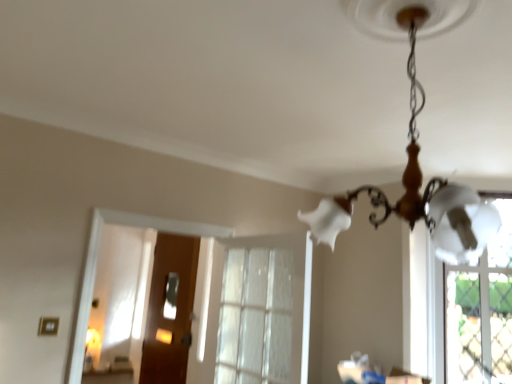
This screenshot has height=384, width=512. I want to click on clear glass window at center, so click(255, 317).

This screenshot has width=512, height=384. What are the coordinates of `wooden door at center` in the screenshot? It's located at (172, 307).

From a real-world perspective, is wooden door at center below white glass chandelier at upper center?

Yes, from a real-world perspective, wooden door at center is under white glass chandelier at upper center.

Is wooden door at center far away from white glass chandelier at upper center?

That's right, there is a large distance between wooden door at center and white glass chandelier at upper center.

Is wooden door at center in front of white glass chandelier at upper center?

No, the depth of wooden door at center is greater than that of white glass chandelier at upper center.

Consider the image. Which is correct: wooden door at center is inside clear glass window at center, or outside of it?

wooden door at center is not inside clear glass window at center, it's outside.

From the image's perspective, is wooden door at center positioned above or below clear glass window at center?

Based on their image positions, wooden door at center is located beneath clear glass window at center.

Find the location of a particular element. window lying above the wooden door at center (from the image's perspective) is located at coordinates (255, 317).

Is wooden door at center taller or shorter than clear glass window at center?

In the image, wooden door at center appears to be taller than clear glass window at center.

Image resolution: width=512 pixels, height=384 pixels. Identify the location of window below the white glass chandelier at upper center (from the image's perspective). (255, 317).

Can you tell me how much clear glass window at center and white glass chandelier at upper center differ in facing direction?

The angle between the facing direction of clear glass window at center and the facing direction of white glass chandelier at upper center is 75.4 degrees.

Are clear glass window at center and white glass chandelier at upper center far apart?

clear glass window at center is far away from white glass chandelier at upper center.

From the image's perspective, which is below, white glass chandelier at upper center or wooden door at center?

From the image's view, wooden door at center is below.

Is white glass chandelier at upper center facing away from wooden door at center?

No, white glass chandelier at upper center's orientation is not away from wooden door at center.

Is white glass chandelier at upper center shorter than wooden door at center?

Yes, white glass chandelier at upper center is shorter than wooden door at center.

Considering the positions of objects white glass chandelier at upper center and wooden door at center in the image provided, who is more to the right, white glass chandelier at upper center or wooden door at center?

white glass chandelier at upper center.

Between point (243, 361) and point (157, 271), which one is positioned in front?

The point (243, 361) is in front.

From a real-world perspective, which object stands above the other?

clear glass window at center, from a real-world perspective.

Locate an element on the screen. The width and height of the screenshot is (512, 384). window on the right of the wooden door at center is located at coordinates (255, 317).

Considering the sizes of objects clear glass window at center and wooden door at center in the image provided, who is shorter, clear glass window at center or wooden door at center?

clear glass window at center is shorter.

Can you confirm if white glass chandelier at upper center is bigger than clear glass window at center?

Yes.

From a real-world perspective, is white glass chandelier at upper center under clear glass window at center?

Incorrect, from a real-world perspective, white glass chandelier at upper center is higher than clear glass window at center.

Looking at this image, does white glass chandelier at upper center appear on the right side of clear glass window at center?

Correct, you'll find white glass chandelier at upper center to the right of clear glass window at center.

In order to click on lamp that is above the clear glass window at center (from a real-world perspective) in this screenshot , I will do `click(415, 146)`.

The width and height of the screenshot is (512, 384). Identify the location of lamp on the right of wooden door at center. (415, 146).

Locate an element on the screen. window above the wooden door at center (from the image's perspective) is located at coordinates (255, 317).

In the scene shown: Estimate the real-world distances between objects in this image. Which object is further from wooden door at center, white glass chandelier at upper center or clear glass window at center?

Among the two, white glass chandelier at upper center is located further to wooden door at center.

Which object lies further to the anchor point wooden door at center, clear glass window at center or white glass chandelier at upper center?

white glass chandelier at upper center is further to wooden door at center.

When comparing their distances from clear glass window at center, does white glass chandelier at upper center or wooden door at center seem closer?

wooden door at center lies closer to clear glass window at center than the other object.

Which object lies nearer to the anchor point clear glass window at center, wooden door at center or white glass chandelier at upper center?

The object closer to clear glass window at center is wooden door at center.

From the image, which object appears to be farther from white glass chandelier at upper center, wooden door at center or clear glass window at center?

Based on the image, wooden door at center appears to be further to white glass chandelier at upper center.

Based on their spatial positions, is clear glass window at center or wooden door at center further from white glass chandelier at upper center?

The object further to white glass chandelier at upper center is wooden door at center.

Find the location of a particular element. The width and height of the screenshot is (512, 384). window between white glass chandelier at upper center and wooden door at center in the front-back direction is located at coordinates (255, 317).